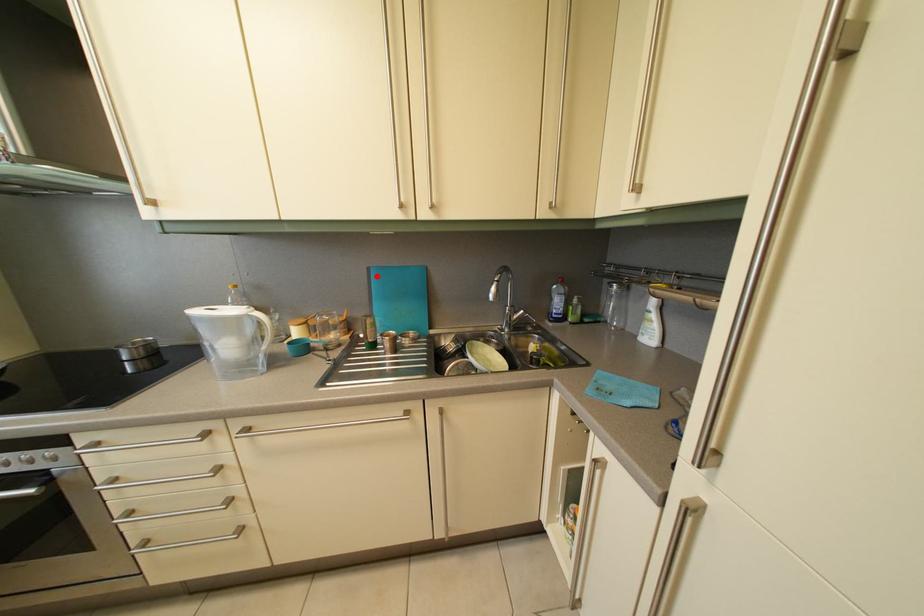
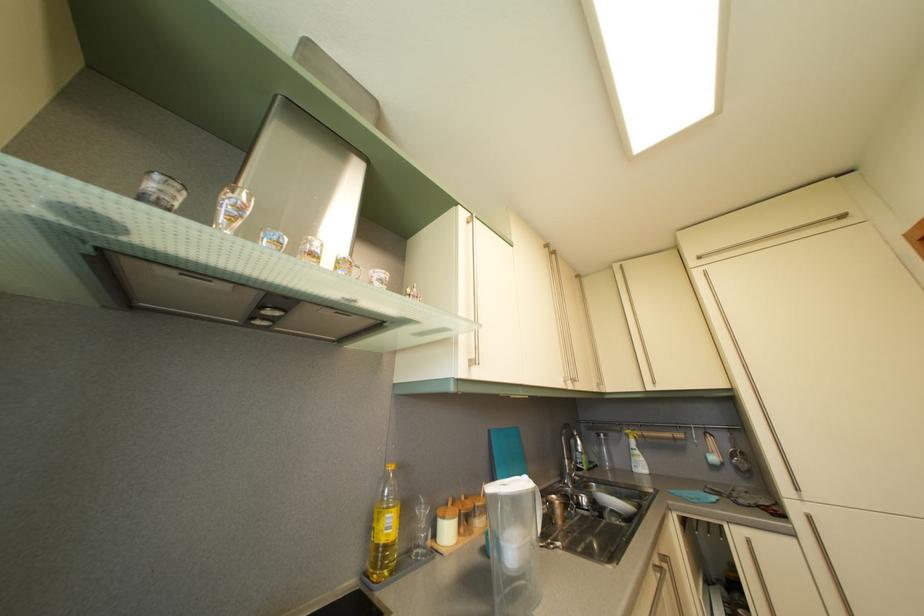
Question: I am providing you with two images of the same scene from different viewpoints. Given a red point in image1, look at the same physical point in image2. Is it:

Choices:
 (A) Closer to the viewpoint
 (B) Farther from the viewpoint

Answer: (B)